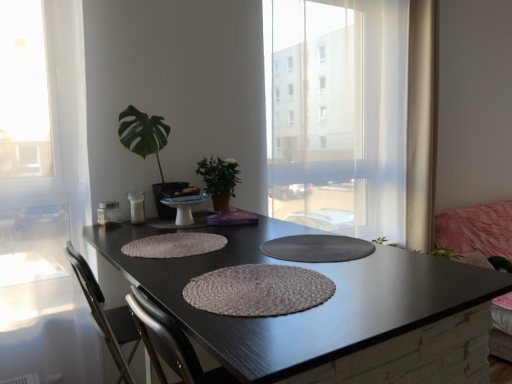
Question: Is white sheer curtain at right smaller than green glossy leafy plant at upper left, the 2th houseplant positioned from the right?

Choices:
 (A) no
 (B) yes

Answer: (A)

Question: Is there a large distance between white sheer curtain at right and green glossy leafy plant at upper left, the first houseplant positioned from the left?

Choices:
 (A) no
 (B) yes

Answer: (B)

Question: Is white sheer curtain at right in front of green glossy leafy plant at upper left, the first houseplant positioned from the left?

Choices:
 (A) no
 (B) yes

Answer: (A)

Question: Is green glossy leafy plant at upper left, the first houseplant positioned from the left, inside white sheer curtain at right?

Choices:
 (A) yes
 (B) no

Answer: (B)

Question: Is white sheer curtain at right shorter than green glossy leafy plant at upper left, the first houseplant positioned from the left?

Choices:
 (A) yes
 (B) no

Answer: (B)

Question: From the image's perspective, is green matte plant at center, which is the first houseplant in right-to-left order, located above or below shiny black table at center?

Choices:
 (A) above
 (B) below

Answer: (A)

Question: Looking at their shapes, would you say green matte plant at center, which is the first houseplant in right-to-left order, is wider or thinner than shiny black table at center?

Choices:
 (A) wide
 (B) thin

Answer: (B)

Question: Considering the positions of point (215, 172) and point (298, 344), is point (215, 172) closer or farther from the camera than point (298, 344)?

Choices:
 (A) farther
 (B) closer

Answer: (A)

Question: In the image, is green matte plant at center, the second houseplant viewed from the left, on the left side or the right side of shiny black table at center?

Choices:
 (A) left
 (B) right

Answer: (A)

Question: From the image's perspective, is rustic woven placemat at center, placed as the first wide when sorted from back to front, located above or below transparent curtain at center?

Choices:
 (A) above
 (B) below

Answer: (B)

Question: Considering the relative positions of rustic woven placemat at center, which is the second wide in front-to-back order, and transparent curtain at center in the image provided, is rustic woven placemat at center, which is the second wide in front-to-back order, to the left or to the right of transparent curtain at center?

Choices:
 (A) left
 (B) right

Answer: (A)

Question: From a real-world perspective, is rustic woven placemat at center, placed as the first wide when sorted from back to front, above or below transparent curtain at center?

Choices:
 (A) above
 (B) below

Answer: (B)

Question: Looking at the image, does rustic woven placemat at center, which is the second wide in front-to-back order, seem bigger or smaller compared to transparent curtain at center?

Choices:
 (A) small
 (B) big

Answer: (A)

Question: Is point (416, 97) positioned closer to the camera than point (378, 334)?

Choices:
 (A) closer
 (B) farther

Answer: (B)

Question: From their relative heights in the image, would you say white sheer curtain at right is taller or shorter than shiny black table at center?

Choices:
 (A) short
 (B) tall

Answer: (B)